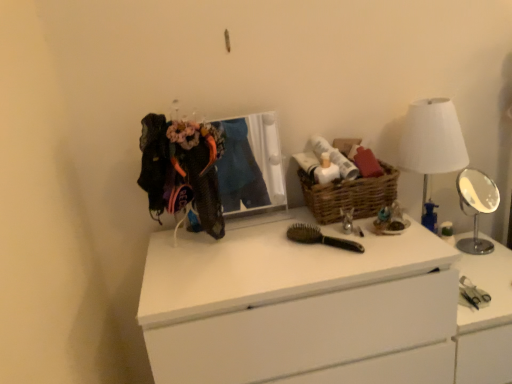
At what (x,y) coordinates should I click in order to perform the action: click on vacant space to the right of knitted fabric clothesline at upper left. Please return your answer as a coordinate pair (x, y). Looking at the image, I should click on 249,240.